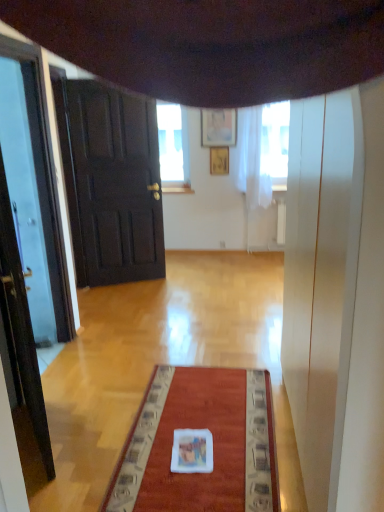
What do you see at coordinates (111, 182) in the screenshot?
I see `matte dark brown door at left` at bounding box center [111, 182].

Identify the location of matte dark brown door at left. (111, 182).

In order to face matte dark brown door at left, should I rotate leftwards or rightwards?

You should rotate left by 9.106 degrees.

Locate an element on the screen. matte dark brown door at left is located at coordinates (111, 182).